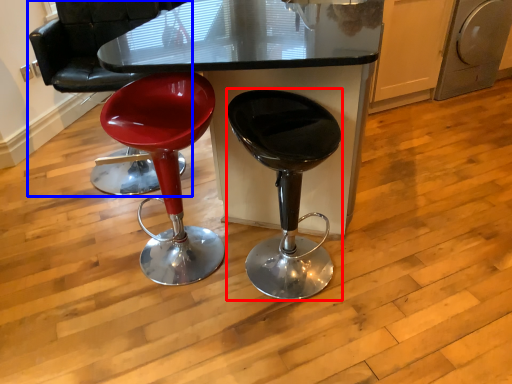
Question: Which object appears farthest to the camera in this image, stool (highlighted by a red box) or chair (highlighted by a blue box)?

Choices:
 (A) stool
 (B) chair

Answer: (B)